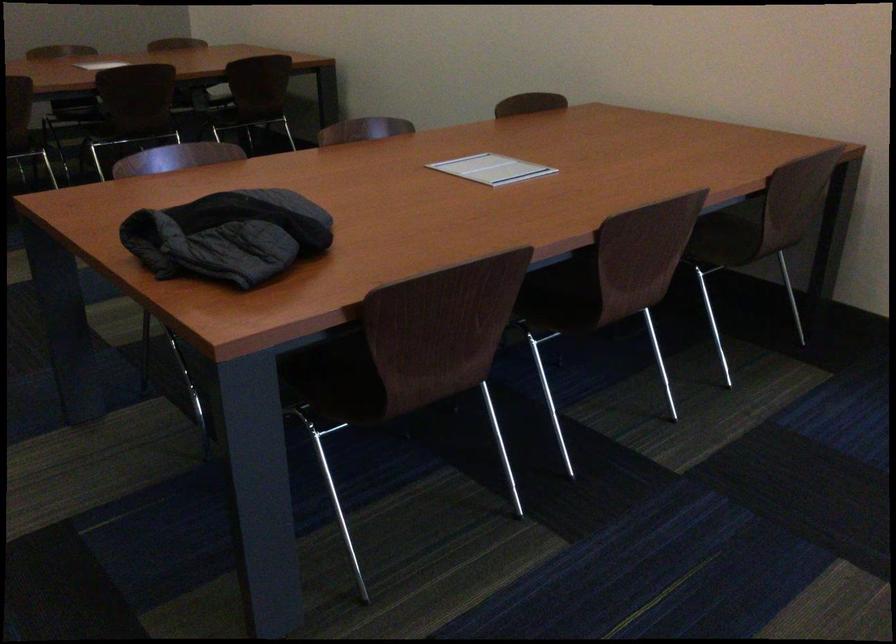
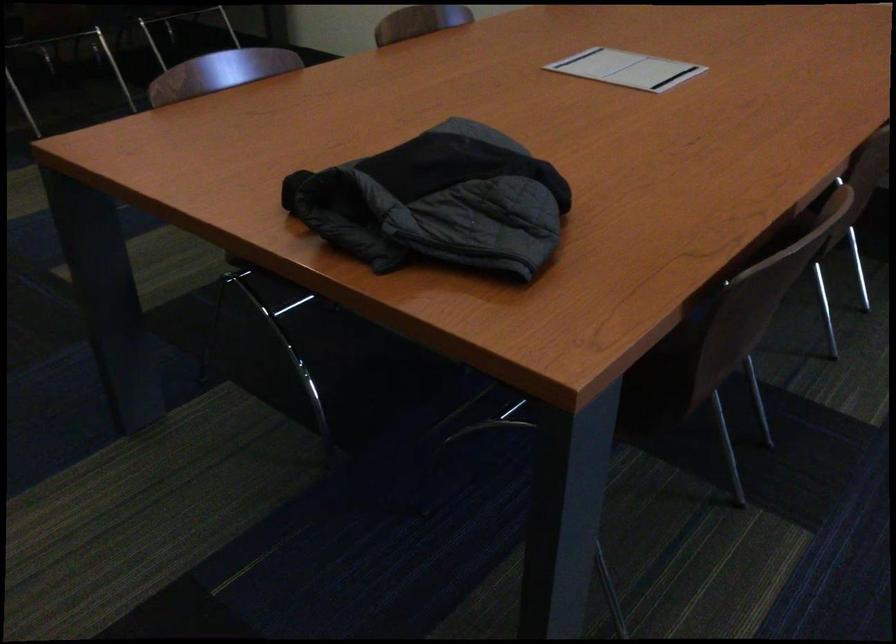
Question: The camera is either moving clockwise (left) or counter-clockwise (right) around the object. The first image is from the beginning of the video and the second image is from the end. Is the camera moving left or right when shooting the video?

Choices:
 (A) Left
 (B) Right

Answer: (A)